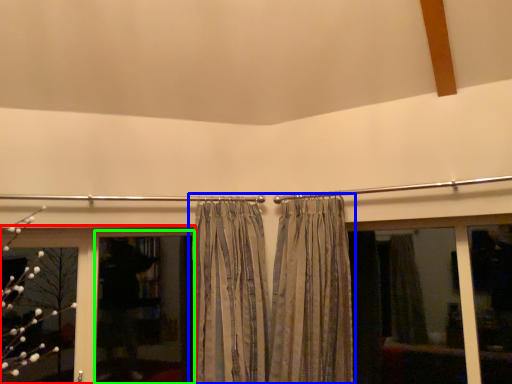
Question: Estimate the real-world distances between objects in this image. Which object is farther from bay window (highlighted by a red box), curtain (highlighted by a blue box) or screen door (highlighted by a green box)?

Choices:
 (A) curtain
 (B) screen door

Answer: (A)